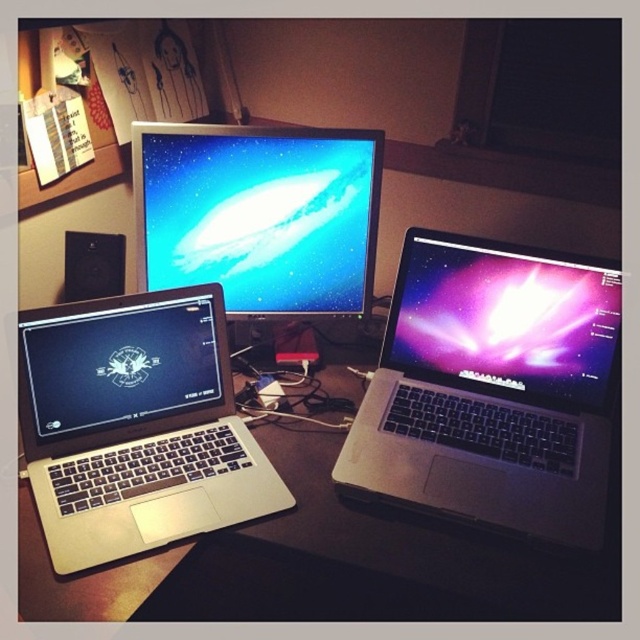
You are organizing a desk and want to place both the glossy metallic laptop at center right and the matte black laptop at lower left into a storage box. The box can only fit one of them. Based on their sizes, which laptop should you prioritize placing first?

The glossy metallic laptop at center right might be wider than matte black laptop at lower left, so it should be prioritized as it may require more space in the storage box.